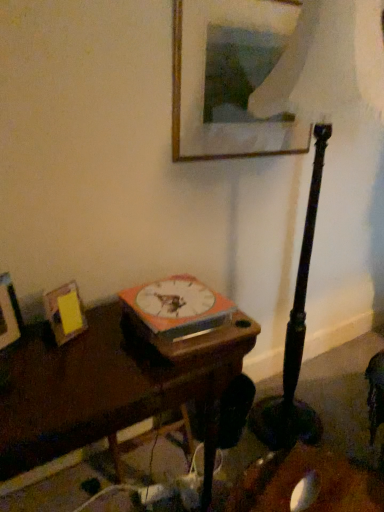
Image resolution: width=384 pixels, height=512 pixels. I want to click on free spot to the right of yellow paper at left, the second picture frame when ordered from top to bottom, so click(x=114, y=344).